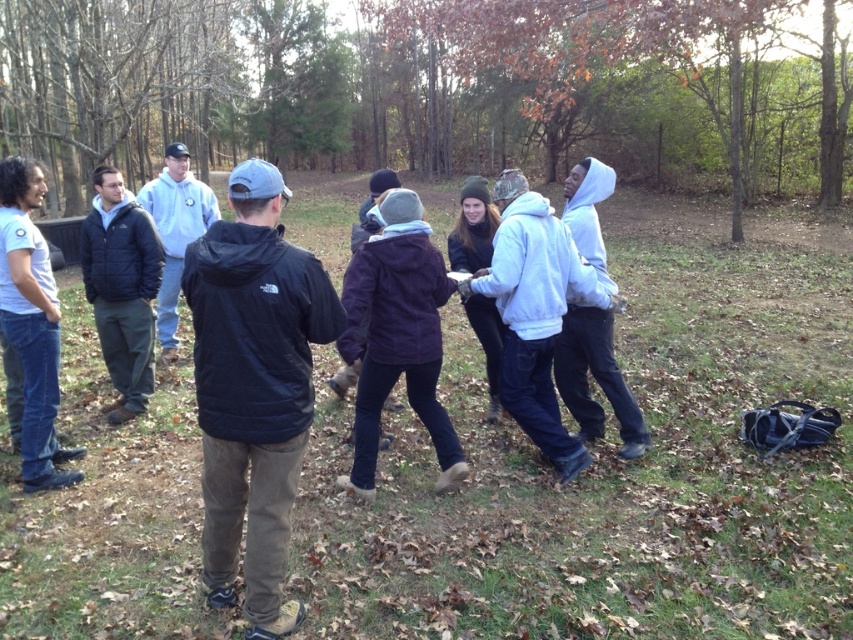
Question: Estimate the real-world distances between objects in this image. Which object is farther from the dark blue jacket at left?

Choices:
 (A) white fleece hoodie at right
 (B) white fleece hoodie at center

Answer: (A)

Question: Does white fleece hoodie at center have a larger size compared to black fleece jacket at center?

Choices:
 (A) no
 (B) yes

Answer: (A)

Question: In this image, where is brown textured tree at upper center located relative to black matte jacket at center?

Choices:
 (A) above
 (B) below

Answer: (A)

Question: Estimate the real-world distances between objects in this image. Which object is closer to the brown textured tree at upper center?

Choices:
 (A) white fleece hoodie at right
 (B) purple fleece jacket at center
 (C) black matte jacket at center
 (D) white matte t-shirt at left

Answer: (B)

Question: Which point appears farthest from the camera in this image?

Choices:
 (A) (584, 348)
 (B) (45, 429)

Answer: (A)

Question: Does brown textured tree at upper center appear on the right side of purple fleece jacket at center?

Choices:
 (A) yes
 (B) no

Answer: (B)